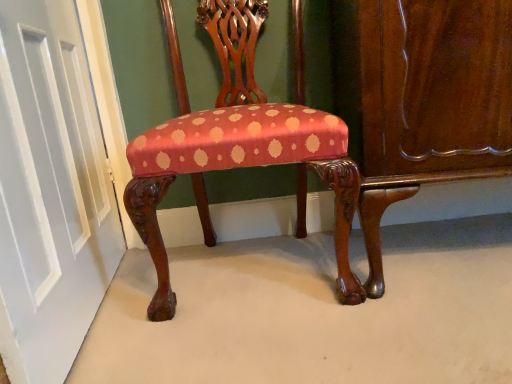
Question: Is white painted wood door at left facing towards silky red fabric chair at center?

Choices:
 (A) no
 (B) yes

Answer: (B)

Question: From the image's perspective, is white painted wood door at left on silky red fabric chair at center?

Choices:
 (A) no
 (B) yes

Answer: (A)

Question: Considering the relative positions of white painted wood door at left and silky red fabric chair at center in the image provided, is white painted wood door at left to the right of silky red fabric chair at center from the viewer's perspective?

Choices:
 (A) yes
 (B) no

Answer: (B)

Question: Does white painted wood door at left have a greater height compared to silky red fabric chair at center?

Choices:
 (A) yes
 (B) no

Answer: (A)

Question: Does white painted wood door at left have a lesser height compared to silky red fabric chair at center?

Choices:
 (A) no
 (B) yes

Answer: (A)

Question: Is glossy wood dresser at lower right wider or thinner than white painted wood door at left?

Choices:
 (A) thin
 (B) wide

Answer: (B)

Question: Is glossy wood dresser at lower right in front of or behind white painted wood door at left in the image?

Choices:
 (A) behind
 (B) front

Answer: (A)

Question: Considering the positions of point (432, 0) and point (69, 6), is point (432, 0) closer or farther from the camera than point (69, 6)?

Choices:
 (A) farther
 (B) closer

Answer: (B)

Question: Visually, is glossy wood dresser at lower right positioned to the left or to the right of white painted wood door at left?

Choices:
 (A) right
 (B) left

Answer: (A)

Question: Does point (53, 165) appear closer or farther from the camera than point (203, 225)?

Choices:
 (A) closer
 (B) farther

Answer: (A)

Question: From a real-world perspective, relative to silky red fabric chair at center, is white painted wood door at left vertically above or below?

Choices:
 (A) above
 (B) below

Answer: (A)

Question: From the image's perspective, is white painted wood door at left above or below silky red fabric chair at center?

Choices:
 (A) below
 (B) above

Answer: (A)

Question: Is white painted wood door at left bigger or smaller than silky red fabric chair at center?

Choices:
 (A) small
 (B) big

Answer: (A)

Question: Is silky red fabric chair at center taller or shorter than white painted wood door at left?

Choices:
 (A) short
 (B) tall

Answer: (A)

Question: Considering the positions of silky red fabric chair at center and white painted wood door at left in the image, is silky red fabric chair at center wider or thinner than white painted wood door at left?

Choices:
 (A) wide
 (B) thin

Answer: (A)